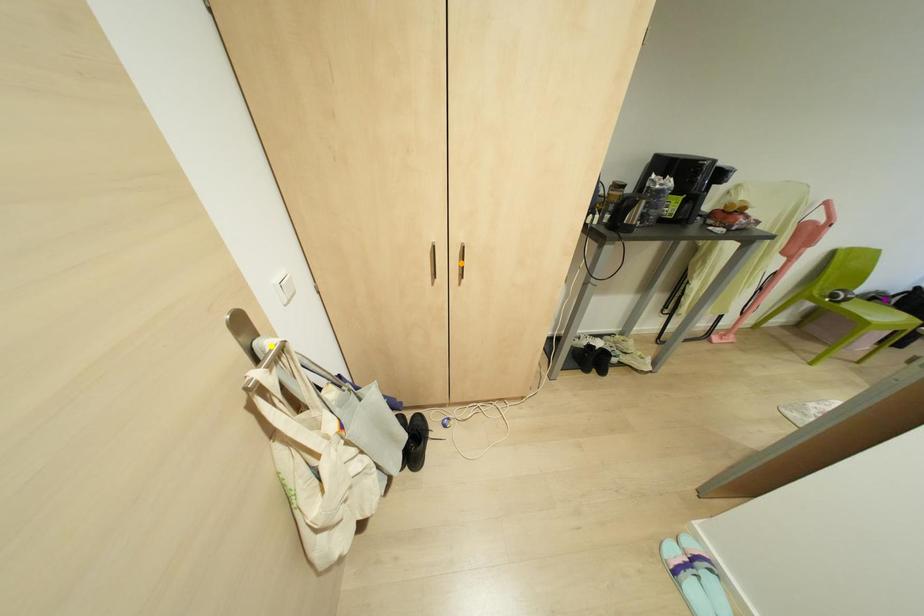
Order these from nearest to farthest:
A) yellow point
B) orange point
C) purple point

yellow point → orange point → purple point